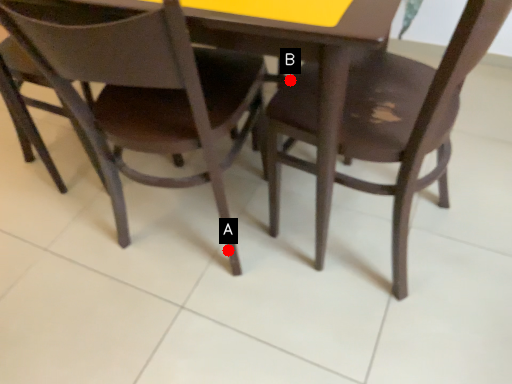
Question: Two points are circled on the image, labeled by A and B beside each circle. Among these points, which one is farthest from the camera?

Choices:
 (A) A is further
 (B) B is further

Answer: (A)